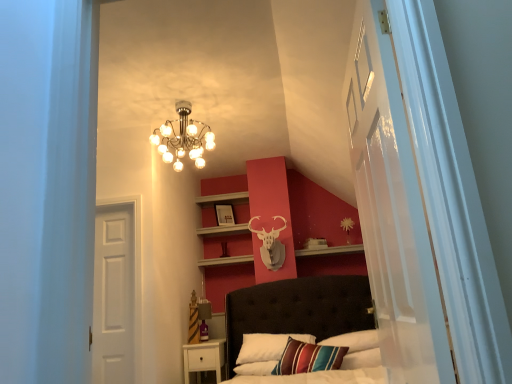
Question: From their relative heights in the image, would you say white matte door at left is taller or shorter than transparent glass door at right?

Choices:
 (A) short
 (B) tall

Answer: (B)

Question: From a real-world perspective, is white matte door at left above or below transparent glass door at right?

Choices:
 (A) above
 (B) below

Answer: (B)

Question: Considering the real-world distances, which object is closest to the white matte door at left?

Choices:
 (A) matte wooden picture frame at upper center
 (B) transparent glass door at right
 (C) metallic chandelier at upper center

Answer: (C)

Question: Which object is positioned closest to the white matte door at left?

Choices:
 (A) metallic chandelier at upper center
 (B) matte wooden picture frame at upper center
 (C) transparent glass door at right

Answer: (A)